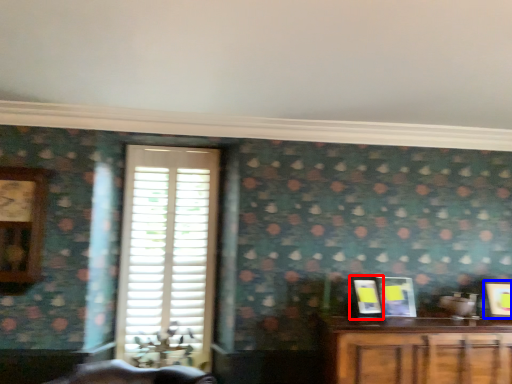
Question: Among these objects, which one is nearest to the camera, picture frame (highlighted by a red box) or picture frame (highlighted by a blue box)?

Choices:
 (A) picture frame
 (B) picture frame

Answer: (A)